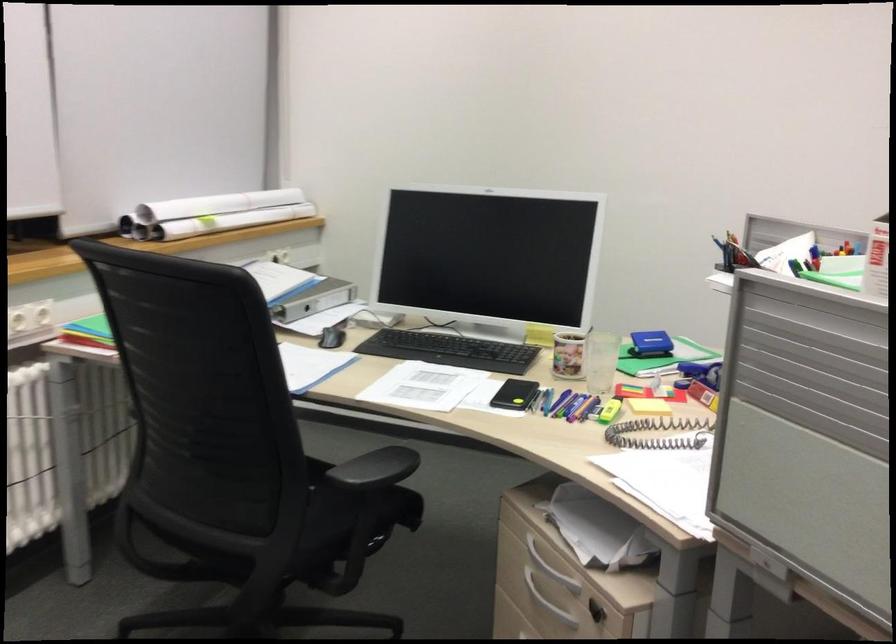
Where is `purple pen`? purple pen is located at coordinates (565, 404).